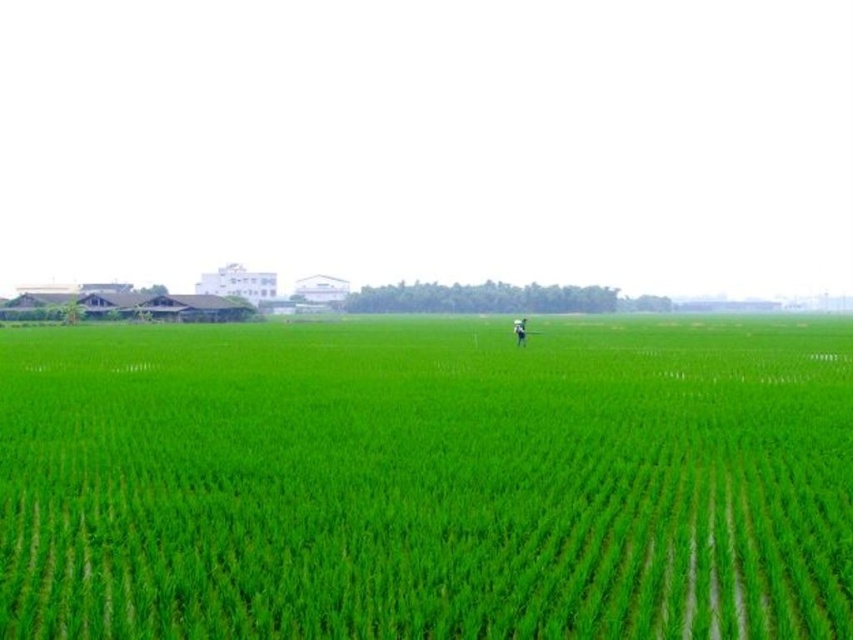
Question: Is green grassy field at center smaller than light blue fabric person at center?

Choices:
 (A) yes
 (B) no

Answer: (B)

Question: Which of the following is the farthest from the observer?

Choices:
 (A) (523, 346)
 (B) (775, 598)

Answer: (A)

Question: Does green grassy field at center appear over light blue fabric person at center?

Choices:
 (A) yes
 (B) no

Answer: (B)

Question: Which of the following is the closest to the observer?

Choices:
 (A) (131, 358)
 (B) (523, 317)

Answer: (A)

Question: Which point is closer to the camera?

Choices:
 (A) (514, 324)
 (B) (65, 580)

Answer: (B)

Question: Is the position of green grassy field at center less distant than that of light blue fabric person at center?

Choices:
 (A) no
 (B) yes

Answer: (B)